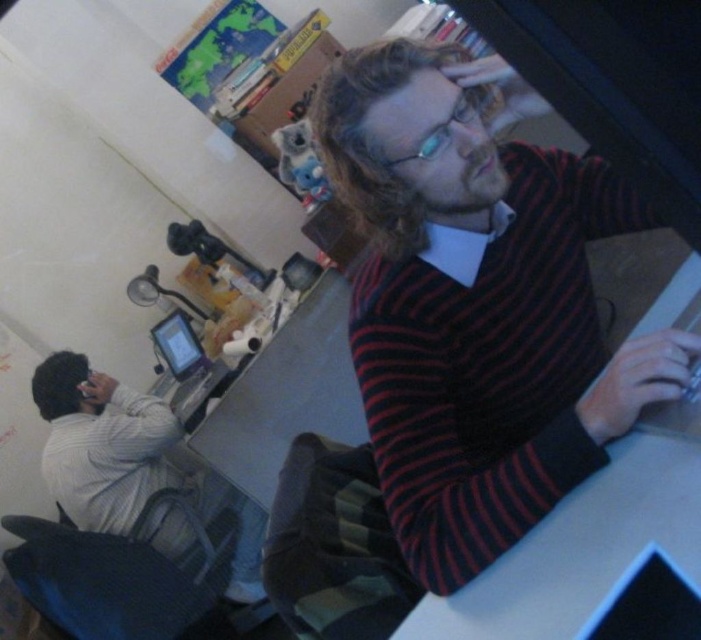
Does striped sweater at center appear on the right side of light gray sweater at left?

Indeed, striped sweater at center is positioned on the right side of light gray sweater at left.

Is striped sweater at center wider than light gray sweater at left?

No.

Is point (477, 141) farther from camera compared to point (149, 525)?

No, it is not.

The height and width of the screenshot is (640, 701). Identify the location of striped sweater at center. (477, 301).

Is white plastic computer desk at center to the left of matte black tablet at center from the viewer's perspective?

No, white plastic computer desk at center is not to the left of matte black tablet at center.

How distant is white plastic computer desk at center from matte black tablet at center?

A distance of 5.68 feet exists between white plastic computer desk at center and matte black tablet at center.

The width and height of the screenshot is (701, 640). Describe the element at coordinates (580, 548) in the screenshot. I see `white plastic computer desk at center` at that location.

Identify the location of white plastic computer desk at center. (580, 548).

Does white plastic computer desk at center have a lesser width compared to light gray sweater at left?

Yes.

Which of these two, white plastic computer desk at center or light gray sweater at left, stands shorter?

white plastic computer desk at center

Is point (592, 609) positioned after point (90, 477)?

No, it is in front of (90, 477).

Locate an element on the screen. The height and width of the screenshot is (640, 701). white plastic computer desk at center is located at coordinates (580, 548).